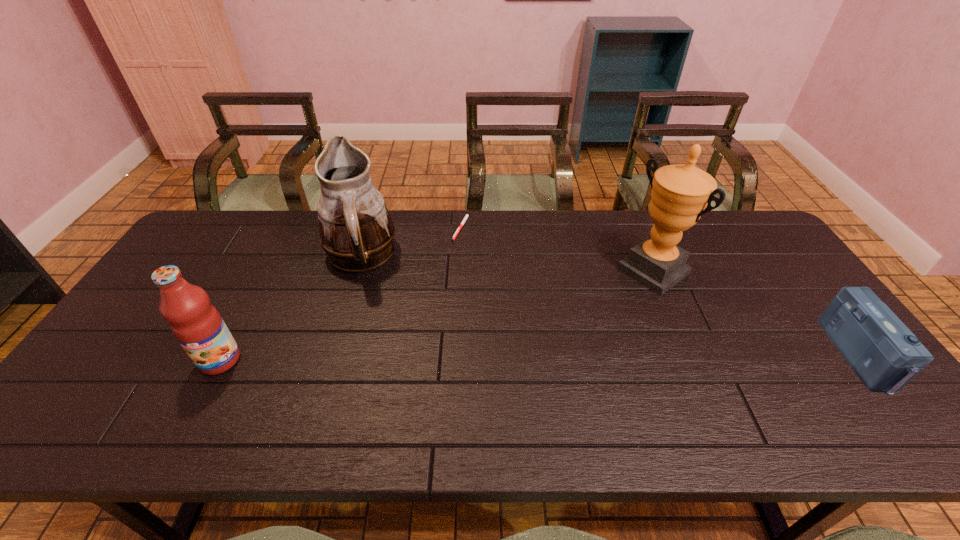
This screenshot has height=540, width=960. Find the location of `vacant point located between the rightmost object and the award`. vacant point located between the rightmost object and the award is located at coordinates (756, 313).

Point out which object is positioned as the nearest to the shortest object. Please provide its 2D coordinates. Your answer should be formatted as a tuple, i.e. [(x, y)], where the tuple contains the x and y coordinates of a point satisfying the conditions above.

[(356, 232)]

The image size is (960, 540). Find the location of `object identified as the closest to the leftmost object`. object identified as the closest to the leftmost object is located at coordinates (356, 232).

The height and width of the screenshot is (540, 960). In order to click on vacant space that satisfies the following two spatial constraints: 1. on the front side of the second object from right to left; 2. on the lens of the fourth tallest object in this screenshot , I will do `click(689, 356)`.

Image resolution: width=960 pixels, height=540 pixels. I want to click on vacant region that satisfies the following two spatial constraints: 1. on the front side of the fourth shortest object; 2. on the lens of the rightmost object, so click(x=330, y=356).